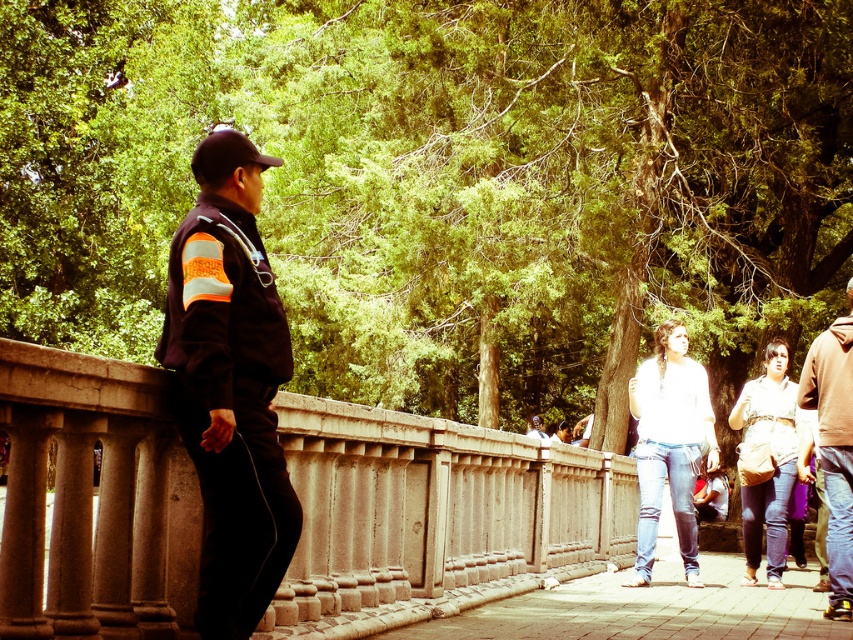
Who is shorter, dark blue uniform at left or brown leather jacket at right?

Standing shorter between the two is dark blue uniform at left.

I want to click on dark blue uniform at left, so click(230, 387).

Describe the element at coordinates (230, 387) in the screenshot. I see `dark blue uniform at left` at that location.

The width and height of the screenshot is (853, 640). What are the coordinates of `dark blue uniform at left` in the screenshot? It's located at (230, 387).

Which is below, smooth concrete railing at center or dark blue uniform at left?

smooth concrete railing at center is below.

Does smooth concrete railing at center have a greater height compared to dark blue uniform at left?

Yes.

Describe the element at coordinates (434, 516) in the screenshot. I see `smooth concrete railing at center` at that location.

Where is `smooth concrete railing at center`? This screenshot has width=853, height=640. smooth concrete railing at center is located at coordinates (434, 516).

Is paved stone sidewalk at center shorter than brown leather jacket at right?

Correct, paved stone sidewalk at center is not as tall as brown leather jacket at right.

Is paved stone sidewalk at center to the right of brown leather jacket at right from the viewer's perspective?

No, paved stone sidewalk at center is not to the right of brown leather jacket at right.

Is point (830, 628) farther from viewer compared to point (824, 371)?

No.

This screenshot has width=853, height=640. I want to click on paved stone sidewalk at center, so click(647, 609).